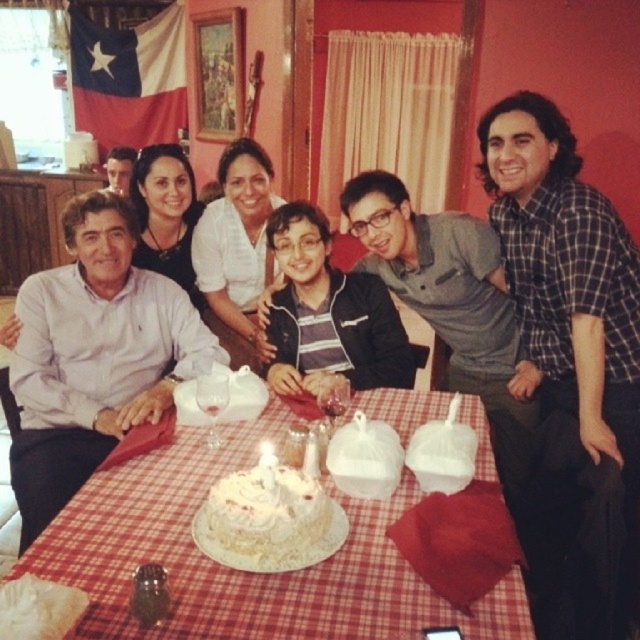
Question: Observing the image, what is the correct spatial positioning of white cake at center in reference to white frosted cake at center?

Choices:
 (A) left
 (B) right

Answer: (B)

Question: Is white cake at center further to camera compared to white frosted cake at center?

Choices:
 (A) yes
 (B) no

Answer: (B)

Question: Considering the relative positions of white cake at center and white frosted cake at center in the image provided, where is white cake at center located with respect to white frosted cake at center?

Choices:
 (A) left
 (B) right

Answer: (B)